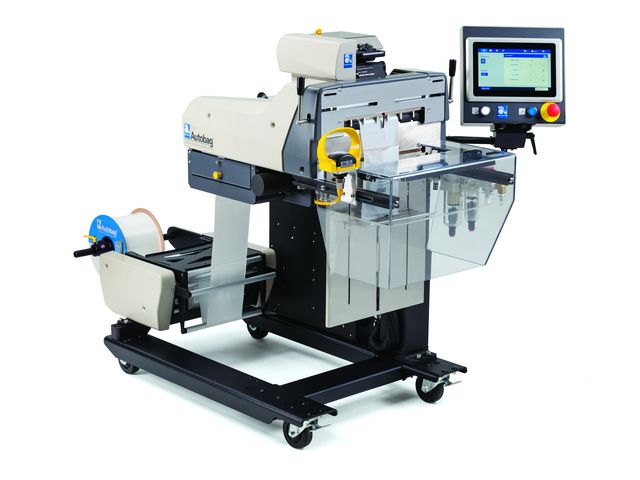
The height and width of the screenshot is (480, 640). I want to click on knob, so click(486, 108).